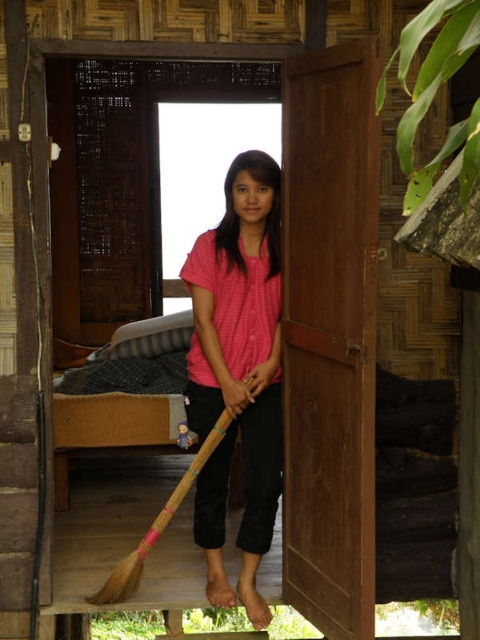
Between brown wooden door at center and pink matte shirt at center, which one has less height?

Standing shorter between the two is pink matte shirt at center.

Where is `brown wooden door at center`? This screenshot has width=480, height=640. brown wooden door at center is located at coordinates (330, 336).

Locate an element on the screen. This screenshot has width=480, height=640. brown wooden door at center is located at coordinates (330, 336).

Measure the distance between brown wooden door at center and camera.

The distance of brown wooden door at center from camera is 7.72 feet.

Can you confirm if brown wooden door at center is positioned below bamboo broom at center?

Incorrect, brown wooden door at center is not positioned below bamboo broom at center.

This screenshot has height=640, width=480. Find the location of `brown wooden door at center`. brown wooden door at center is located at coordinates (330, 336).

What are the coordinates of `brown wooden door at center` in the screenshot? It's located at (330, 336).

Based on the photo, who is more distant from viewer, [217,572] or [115,566]?

Result: Positioned behind is point [115,566].

In the scene shown: Can you confirm if pink matte shirt at center is shorter than bamboo broom at center?

Incorrect, pink matte shirt at center's height does not fall short of bamboo broom at center's.

Between point (190, 269) and point (206, 460), which one is positioned behind?

The point (206, 460) is behind.

The width and height of the screenshot is (480, 640). Find the location of `pink matte shirt at center`. pink matte shirt at center is located at coordinates (239, 371).